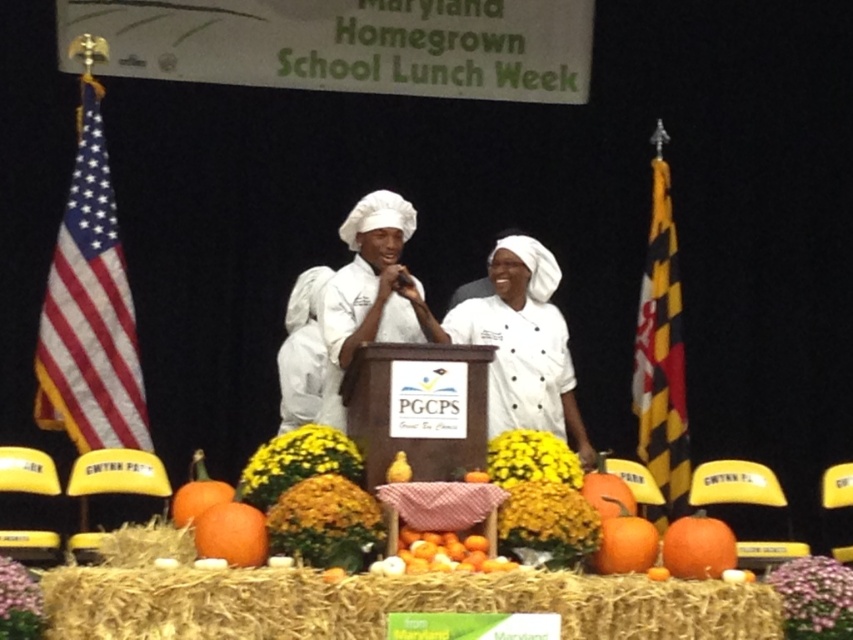
Can you confirm if golden straw hay at center is smaller than american flag at left?

No.

Is the position of golden straw hay at center more distant than that of american flag at left?

No, it is not.

Who is more distant from viewer, [610,608] or [144,410]?

Point [144,410]

The width and height of the screenshot is (853, 640). In order to click on golden straw hay at center in this screenshot , I will do `click(389, 604)`.

Does orange matte pumpkin at lower right have a greater width compared to orange matte at center?

Yes.

Does orange matte pumpkin at lower right appear over orange matte at center?

Incorrect, orange matte pumpkin at lower right is not positioned above orange matte at center.

Which is in front, point (664, 554) or point (454, 545)?

Positioned in front is point (454, 545).

Where is `orange matte pumpkin at lower right`? The height and width of the screenshot is (640, 853). orange matte pumpkin at lower right is located at coordinates [698, 547].

Between golden straw hay at center and orange matte pumpkin at center, which one has more height?

Standing taller between the two is golden straw hay at center.

Can you confirm if golden straw hay at center is positioned to the right of orange matte pumpkin at center?

Correct, you'll find golden straw hay at center to the right of orange matte pumpkin at center.

Locate an element on the screen. The image size is (853, 640). golden straw hay at center is located at coordinates (389, 604).